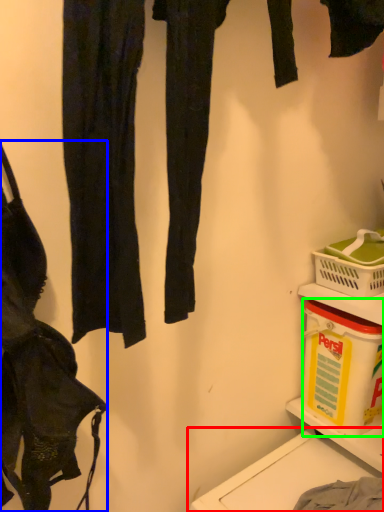
Question: Which object is the closest to the washing (highlighted by a red box)? Choose among these: handbag (highlighted by a blue box) or box (highlighted by a green box).

Choices:
 (A) handbag
 (B) box

Answer: (B)